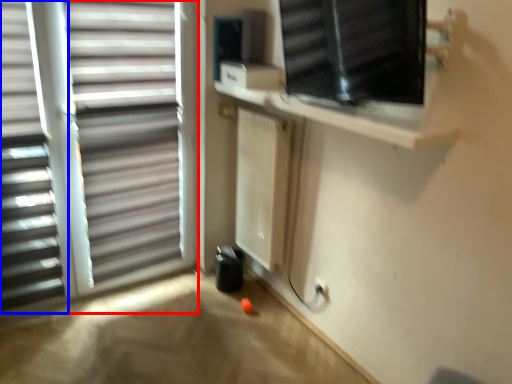
Question: Among these objects, which one is farthest to the camera, window (highlighted by a red box) or window blind (highlighted by a blue box)?

Choices:
 (A) window
 (B) window blind

Answer: (A)